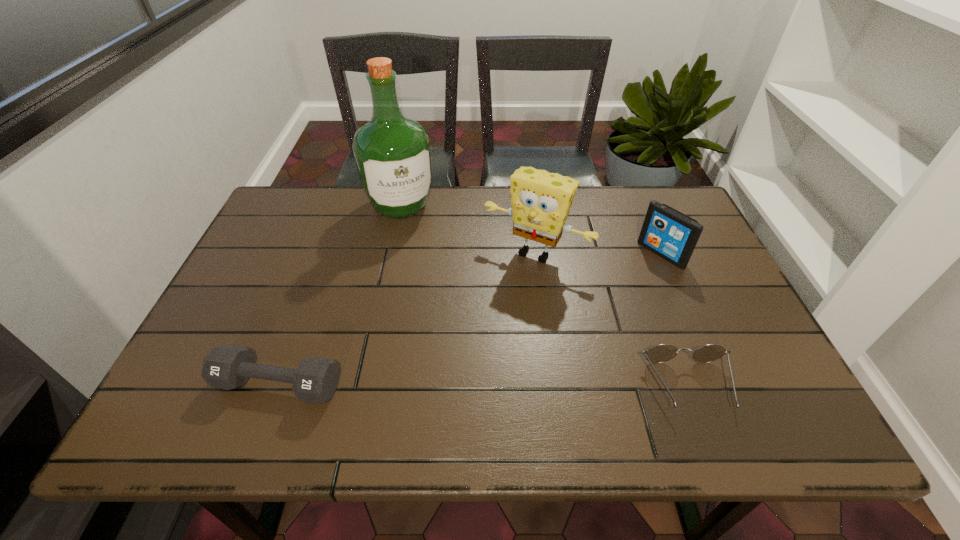
At what (x,y) coordinates should I click in order to perform the action: click on object that is the second closest to the second tallest object. Please return your answer as a coordinate pair (x, y). Looking at the image, I should click on (392, 153).

Identify the location of vacant area in the image that satisfies the following two spatial constraints: 1. on the back side of the third object from right to left; 2. on the left side of the dumbbell. (326, 253).